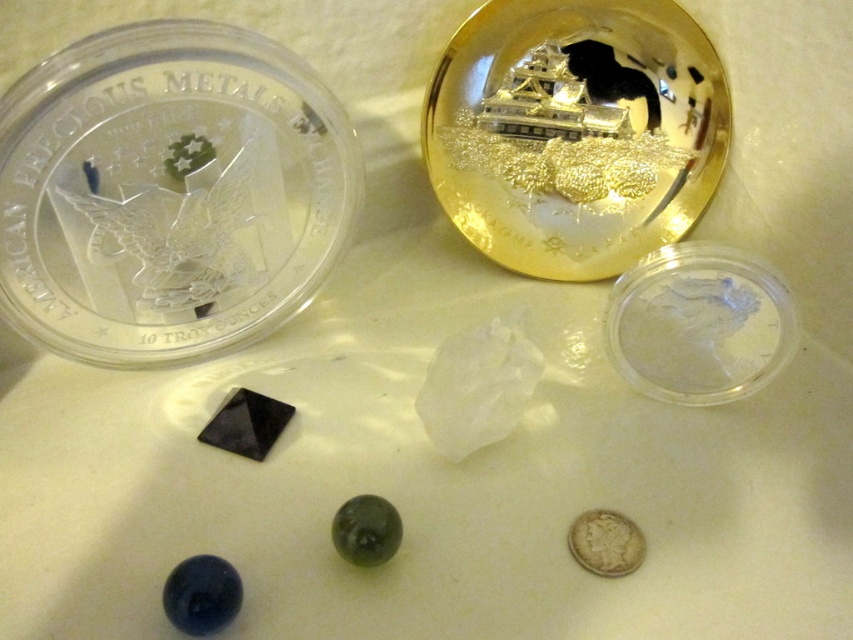
Based on the scene description, where is the gold reflective coin at upper center located in terms of its 2D coordinates?

The gold reflective coin at upper center is located at the 2D coordinates of point (x=575, y=131).

Consider the image. You are looking at the image and want to determine the relative positions of two points marked in the scene. Which point is closer to you, point at coordinates point (686,147) or point (621,531)?

Point (686,147) is further to the viewer than point (621,531), so point (621,531) is closer to you.